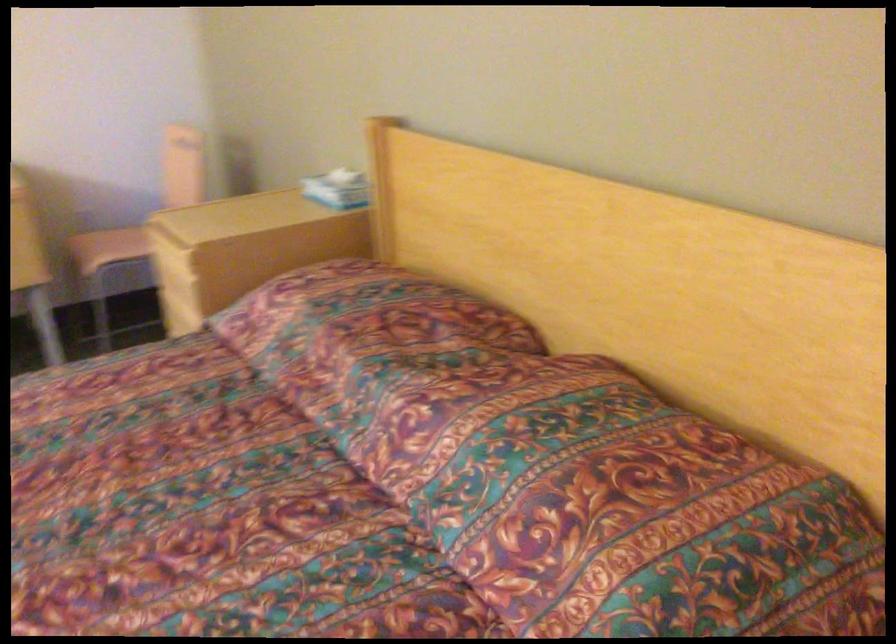
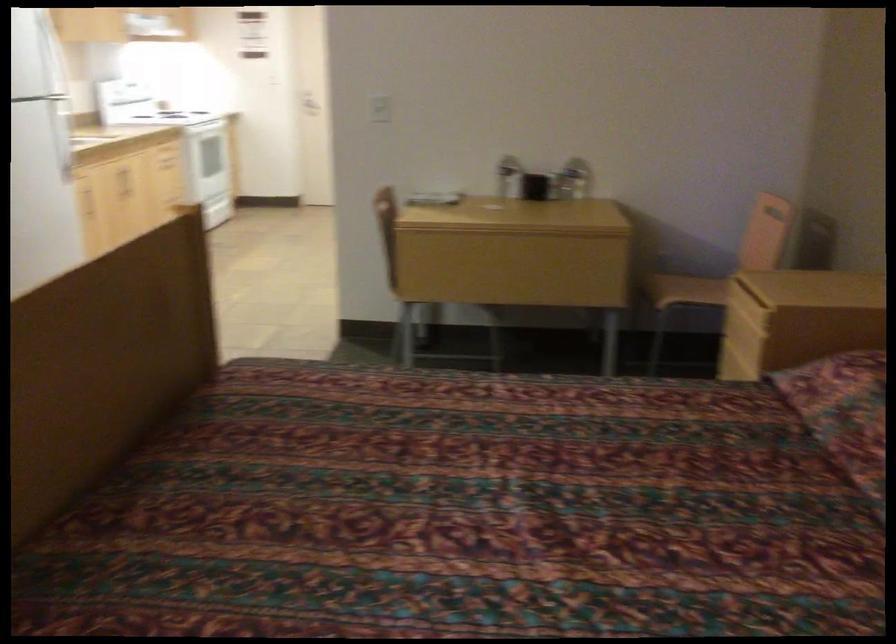
Question: Based on the continuous images, in which direction is the camera rotating? Reply with the corresponding letter.

Choices:
 (A) Left
 (B) Right
 (C) Up
 (D) Down

Answer: (A)